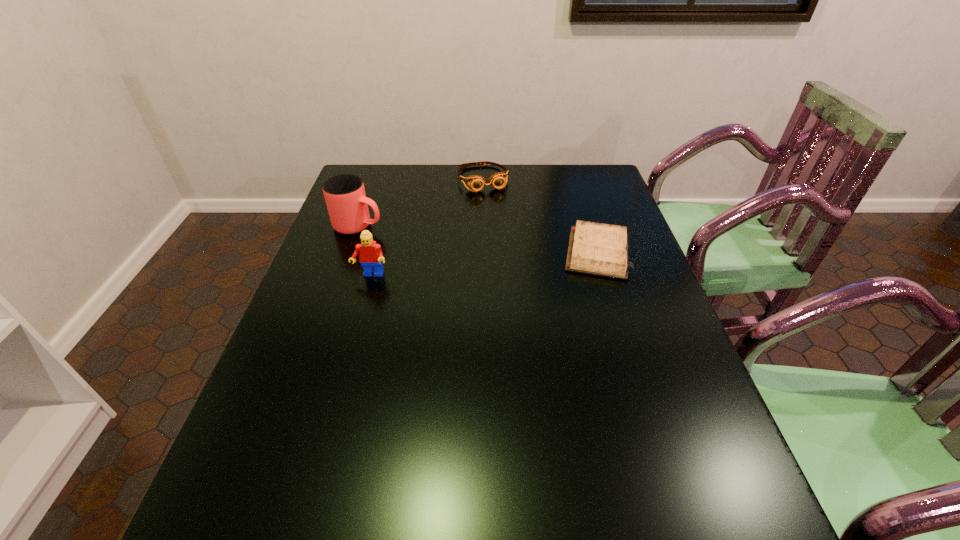
You are a GUI agent. You are given a task and a screenshot of the screen. Output one action in this format:
    pyautogui.click(x=<x>, y=<y>)
    Task: Click on the free spot on the desktop that is between the Lego and the shortest object and is positioned with the lenses facing forward on the second object from right to left
    This screenshot has width=960, height=540.
    Given the screenshot: What is the action you would take?
    point(518,260)

Identify the location of free space on the desktop that is between the Lego and the rightmost object and is positioned on the handle side of the cup. (494, 263).